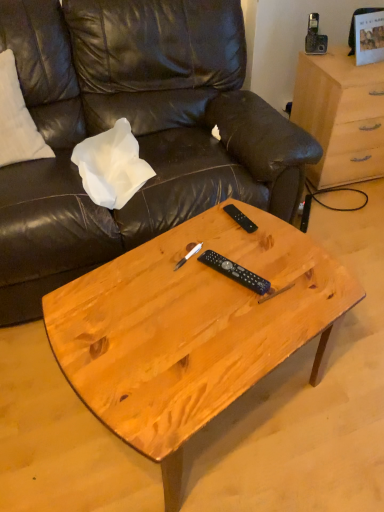
Question: Is natural wood coffee table at center shorter than white paper at upper left?

Choices:
 (A) yes
 (B) no

Answer: (B)

Question: Does natural wood coffee table at center have a larger size compared to white paper at upper left?

Choices:
 (A) no
 (B) yes

Answer: (B)

Question: Can you confirm if natural wood coffee table at center is smaller than white paper at upper left?

Choices:
 (A) no
 (B) yes

Answer: (A)

Question: Is natural wood coffee table at center directly adjacent to white paper at upper left?

Choices:
 (A) no
 (B) yes

Answer: (A)

Question: Is natural wood coffee table at center not inside white paper at upper left?

Choices:
 (A) yes
 (B) no

Answer: (A)

Question: From a real-world perspective, is natural wood coffee table at center on top of white paper at upper left?

Choices:
 (A) no
 (B) yes

Answer: (A)

Question: Considering the relative sizes of white paper at upper left and light brown wood desk at upper right in the image provided, is white paper at upper left bigger than light brown wood desk at upper right?

Choices:
 (A) no
 (B) yes

Answer: (A)

Question: Is white paper at upper left located outside light brown wood desk at upper right?

Choices:
 (A) yes
 (B) no

Answer: (A)

Question: Does white paper at upper left have a greater width compared to light brown wood desk at upper right?

Choices:
 (A) yes
 (B) no

Answer: (B)

Question: Is white paper at upper left facing away from light brown wood desk at upper right?

Choices:
 (A) no
 (B) yes

Answer: (A)

Question: From a real-world perspective, is white paper at upper left below light brown wood desk at upper right?

Choices:
 (A) yes
 (B) no

Answer: (B)

Question: Is white paper at upper left in front of light brown wood desk at upper right?

Choices:
 (A) no
 (B) yes

Answer: (B)

Question: Does black plastic remote at center, which is the 2th remote in front-to-back order, have a greater height compared to black plastic remote at center, acting as the 2th remote starting from the top?

Choices:
 (A) no
 (B) yes

Answer: (A)